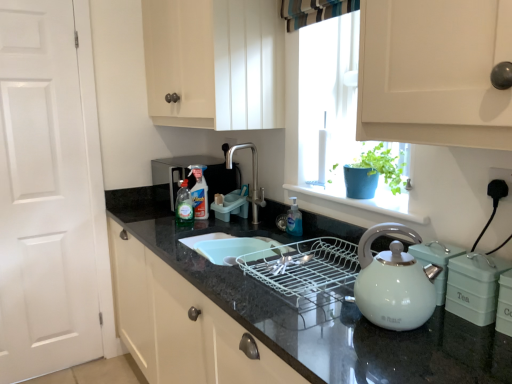
Question: Is black plastic plug at lower right far away from translucent plastic bottle at center, which appears as the first bottle when viewed from the left?

Choices:
 (A) yes
 (B) no

Answer: (A)

Question: Considering the relative positions of black plastic plug at lower right and translucent plastic bottle at center, arranged as the 3th bottle when viewed from the right, in the image provided, is black plastic plug at lower right in front of translucent plastic bottle at center, arranged as the 3th bottle when viewed from the right,?

Choices:
 (A) yes
 (B) no

Answer: (A)

Question: Can you confirm if black plastic plug at lower right is positioned to the right of translucent plastic bottle at center, which appears as the first bottle when viewed from the left?

Choices:
 (A) yes
 (B) no

Answer: (A)

Question: Does black plastic plug at lower right have a greater width compared to translucent plastic bottle at center, which is the second bottle in front-to-back order?

Choices:
 (A) no
 (B) yes

Answer: (A)

Question: Is black plastic plug at lower right turned away from translucent plastic bottle at center, which appears as the first bottle when viewed from the left?

Choices:
 (A) yes
 (B) no

Answer: (B)

Question: Considering the relative sizes of black plastic plug at lower right and translucent plastic bottle at center, the second bottle positioned from the back, in the image provided, is black plastic plug at lower right taller than translucent plastic bottle at center, the second bottle positioned from the back,?

Choices:
 (A) yes
 (B) no

Answer: (B)

Question: From a real-world perspective, does translucent plastic bottle at center, the second bottle positioned from the back, stand above black granite countertop at center?

Choices:
 (A) no
 (B) yes

Answer: (B)

Question: Considering the relative sizes of translucent plastic bottle at center, the second bottle positioned from the back, and black granite countertop at center in the image provided, is translucent plastic bottle at center, the second bottle positioned from the back, wider than black granite countertop at center?

Choices:
 (A) no
 (B) yes

Answer: (A)

Question: Is translucent plastic bottle at center, which appears as the first bottle when viewed from the left, thinner than black granite countertop at center?

Choices:
 (A) yes
 (B) no

Answer: (A)

Question: Does translucent plastic bottle at center, the second bottle positioned from the back, lie in front of black granite countertop at center?

Choices:
 (A) no
 (B) yes

Answer: (A)

Question: Considering the relative positions of translucent plastic bottle at center, arranged as the 3th bottle when viewed from the right, and black granite countertop at center in the image provided, is translucent plastic bottle at center, arranged as the 3th bottle when viewed from the right, behind black granite countertop at center?

Choices:
 (A) yes
 (B) no

Answer: (A)

Question: Does translucent plastic bottle at center, arranged as the 3th bottle when viewed from the right, turn towards black granite countertop at center?

Choices:
 (A) yes
 (B) no

Answer: (B)

Question: From a real-world perspective, is polished stainless steel faucet at center below black plastic plug at lower right?

Choices:
 (A) yes
 (B) no

Answer: (A)